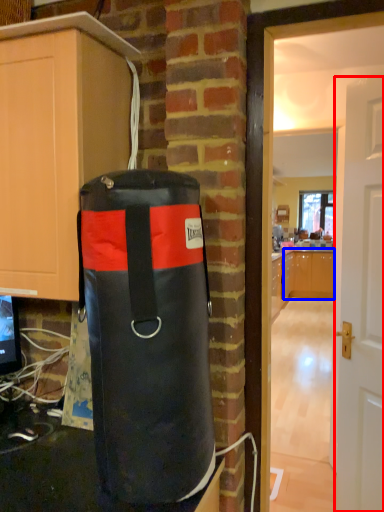
Question: Which object is closer to the camera taking this photo, door (highlighted by a red box) or cabinetry (highlighted by a blue box)?

Choices:
 (A) door
 (B) cabinetry

Answer: (A)